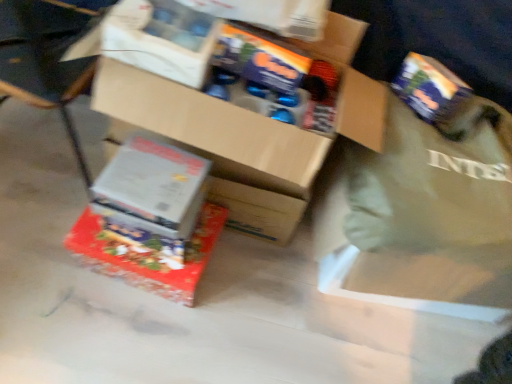
Where is `free point in front of shiny metallic box at center, placed as the 3th box when sorted from top to bottom`? The height and width of the screenshot is (384, 512). free point in front of shiny metallic box at center, placed as the 3th box when sorted from top to bottom is located at coordinates (115, 332).